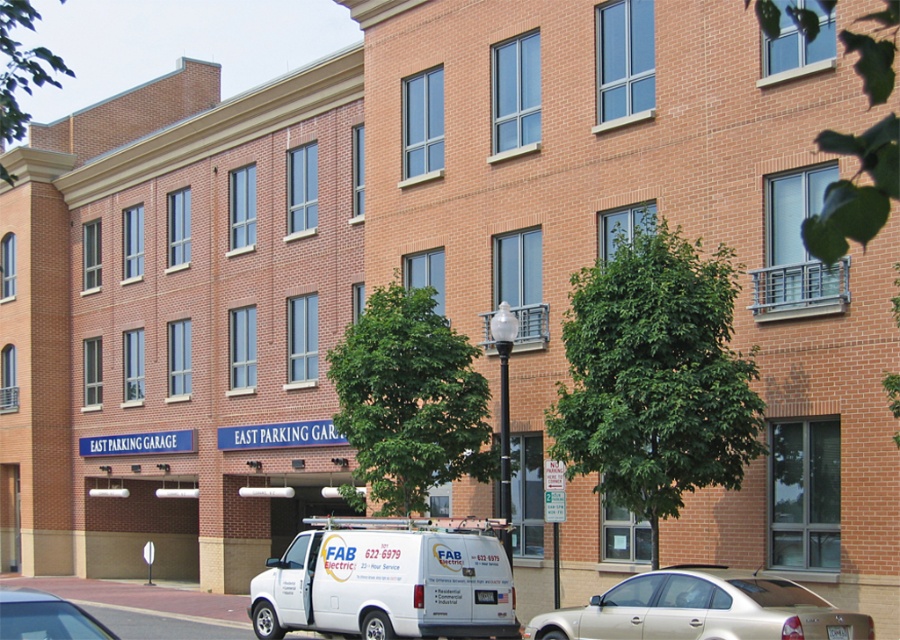
You are standing at the EAST PARKING GARAGE entrance and want to park your car. There is a gold metallic sedan at lower center and a white matte van at lower left blocking the path. Which vehicle is closer to you, and can you maneuver around it to enter the parking garage?

The gold metallic sedan at lower center is closer to you than the white matte van at lower left. Since the sedan is closer, you can maneuver around it to enter the parking garage.

You are a delivery driver who needs to park your white matte van at center in the EAST PARKING GARAGE. The parking spot you want is near the entrance. However, there is another white matte van at lower left blocking the path. Can you safely maneuver around it to reach the entrance without hitting it?

The distance between the white matte van at center and the white matte van at lower left is 25.23 meters, which provides enough space to safely maneuver around the van. You can drive around it without any issues.

You are a delivery driver approaching the EAST PARKING GARAGE entrance. You see a white matte van at center and a gold metallic sedan at lower center. Which vehicle is closer to you as you approach the entrance?

The white matte van at center is closer to you because it is further to the viewer than the gold metallic sedan at lower center, meaning it is positioned nearer in the scene.